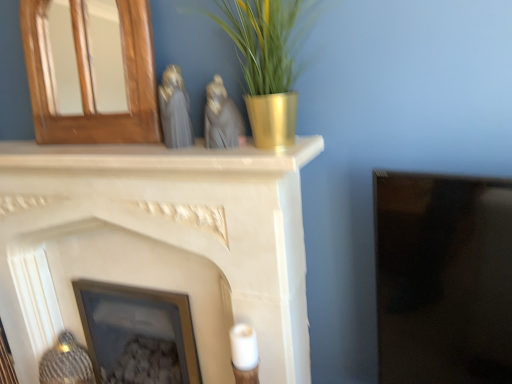
Question: Based on their positions, is matte gray statue at center, which is the 1th animal in right-to-left order, located to the left or right of satin gray statue at center, which appears as the 2th animal when viewed from the right?

Choices:
 (A) right
 (B) left

Answer: (A)

Question: From the image's perspective, is matte gray statue at center, the 2th animal positioned from the left, positioned above or below satin gray statue at center, the 1th animal in the left-to-right sequence?

Choices:
 (A) above
 (B) below

Answer: (B)

Question: Which object is the farthest from the matte glass picture frame at center?

Choices:
 (A) wooden mirror at upper left, the 2th fireplace ordered from the bottom
 (B) matte gray statue at center, which is the 1th animal in right-to-left order
 (C) satin gray statue at center, the 1th animal in the left-to-right sequence
 (D) white matte fireplace at center, placed as the first fireplace when sorted from bottom to top

Answer: (B)

Question: Estimate the real-world distances between objects in this image. Which object is closer to the matte glass picture frame at center?

Choices:
 (A) wooden mirror at upper left, which appears as the 1th fireplace when viewed from the top
 (B) matte gray statue at center, the 2th animal positioned from the left
 (C) white matte fireplace at center, which is counted as the second fireplace, starting from the top
 (D) satin gray statue at center, the 1th animal in the left-to-right sequence

Answer: (C)